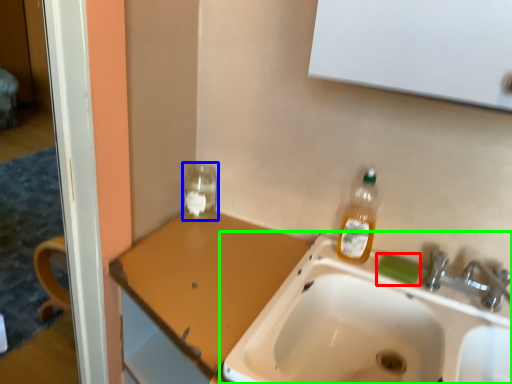
Question: Which is nearer to the soap (highlighted by a red box)? glass jar (highlighted by a blue box) or sink (highlighted by a green box).

Choices:
 (A) glass jar
 (B) sink

Answer: (B)